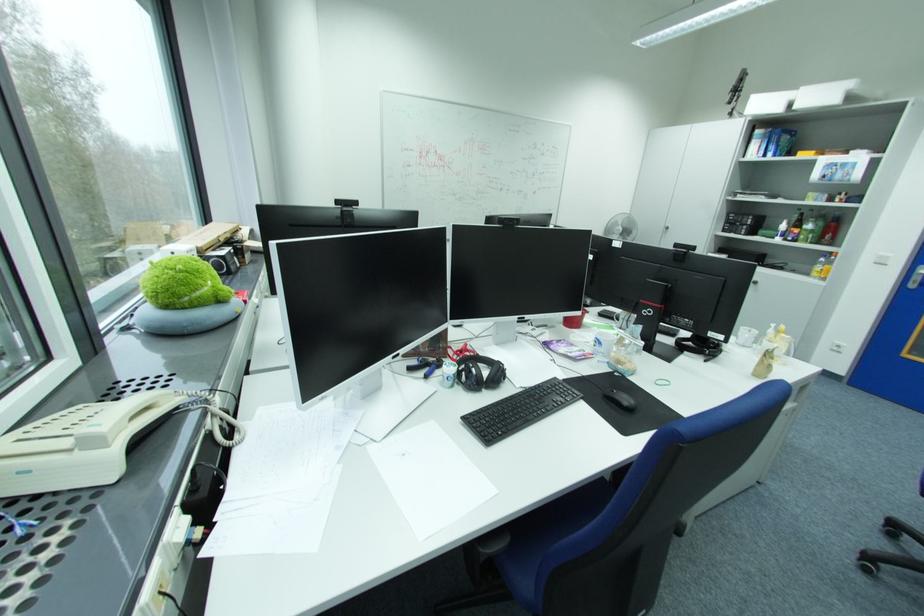
What are the coordinates of `beige telephone handset` in the screenshot? It's located at (94, 440).